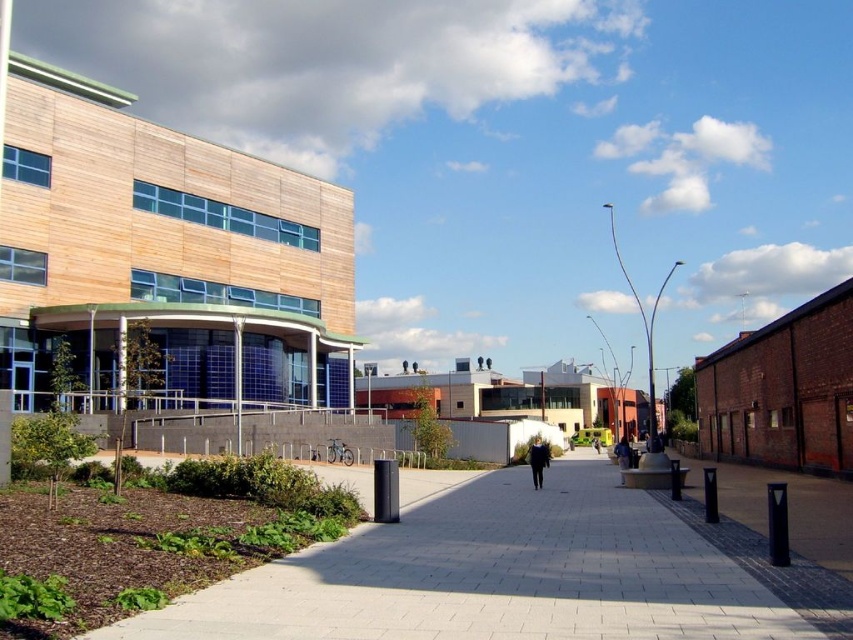
Question: Which point appears closest to the camera in this image?

Choices:
 (A) (596, 448)
 (B) (544, 465)

Answer: (B)

Question: Does dark blue jacket at center lie behind black fabric jacket at center?

Choices:
 (A) no
 (B) yes

Answer: (A)

Question: Which point is closer to the camera?

Choices:
 (A) (596, 445)
 (B) (534, 458)
 (C) (508, 620)

Answer: (C)

Question: Is smooth concrete pavement at center wider than black fabric jacket at center?

Choices:
 (A) yes
 (B) no

Answer: (A)

Question: Is smooth concrete pavement at center below dark blue jacket at center?

Choices:
 (A) yes
 (B) no

Answer: (B)

Question: Estimate the real-world distances between objects in this image. Which object is farther from the black fabric jacket at center?

Choices:
 (A) smooth concrete pavement at center
 (B) dark blue jacket at center

Answer: (A)